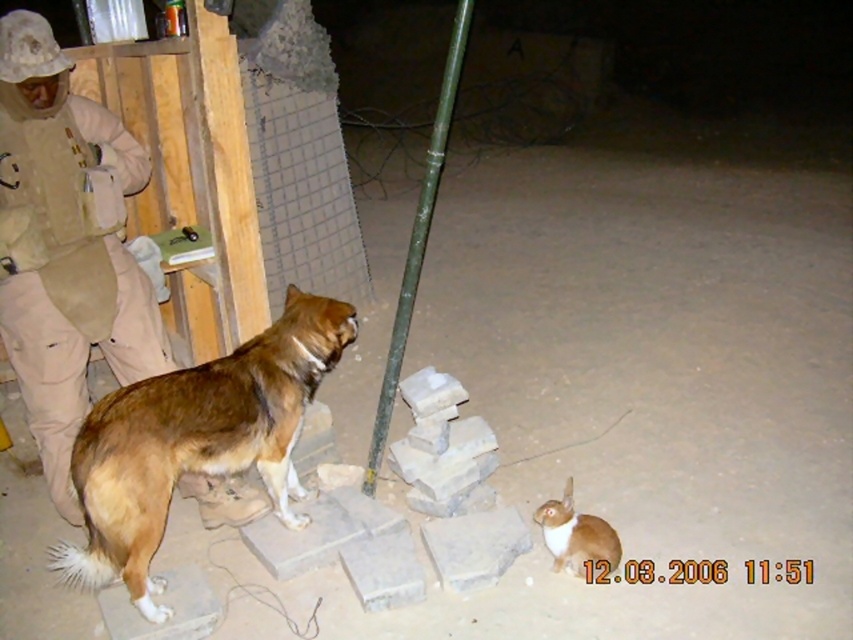
Can you confirm if tan/khaki uniform at left is smaller than green painted wood pole at center?

Indeed, tan/khaki uniform at left has a smaller size compared to green painted wood pole at center.

Who is positioned more to the right, tan/khaki uniform at left or green painted wood pole at center?

green painted wood pole at center is more to the right.

The height and width of the screenshot is (640, 853). In order to click on tan/khaki uniform at left in this screenshot , I will do click(x=67, y=250).

How far apart are tan/khaki uniform at left and orange fur cat at lower right?

1.73 meters

Which is behind, point (9, 138) or point (589, 528)?

Positioned behind is point (589, 528).

Where is `tan/khaki uniform at left`? This screenshot has width=853, height=640. tan/khaki uniform at left is located at coordinates (67, 250).

Can you confirm if green painted wood pole at center is bigger than orange fur cat at lower right?

Yes, green painted wood pole at center is bigger than orange fur cat at lower right.

Between green painted wood pole at center and orange fur cat at lower right, which one is positioned higher?

Positioned higher is green painted wood pole at center.

Which is in front, point (418, 262) or point (556, 541)?

Point (556, 541) is in front.

This screenshot has width=853, height=640. What are the coordinates of `green painted wood pole at center` in the screenshot? It's located at (416, 241).